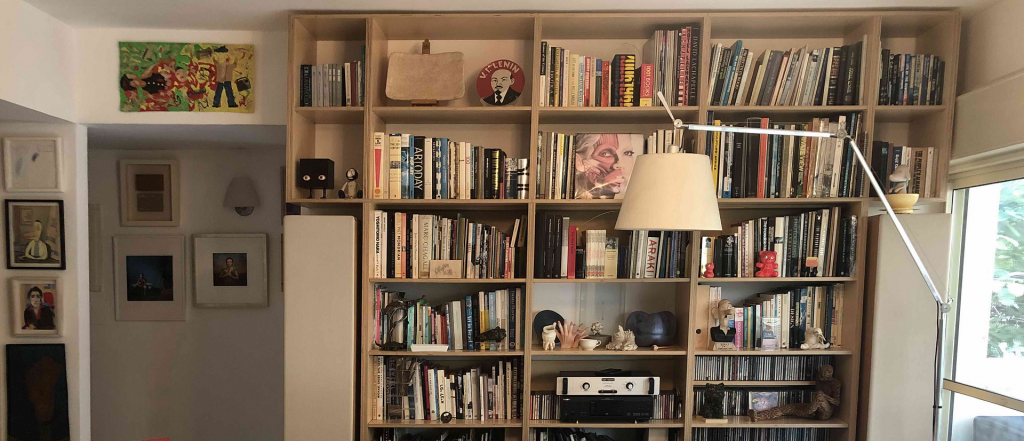
You are a GUI agent. You are given a task and a screenshot of the screen. Output one action in this format:
    pyautogui.click(x=<x>, y=<y>)
    Task: Click on the window
    
    Given the screenshot: What is the action you would take?
    click(x=1001, y=287)